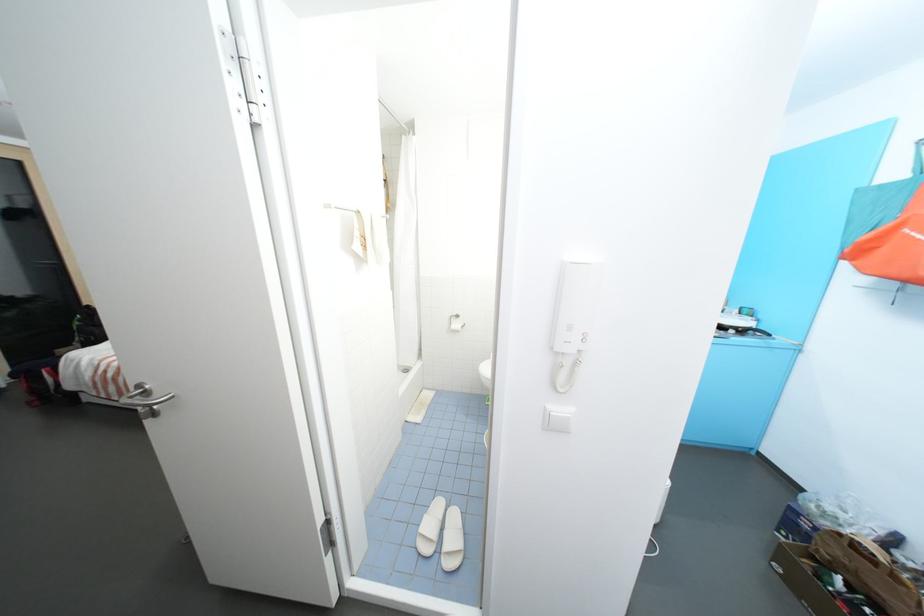
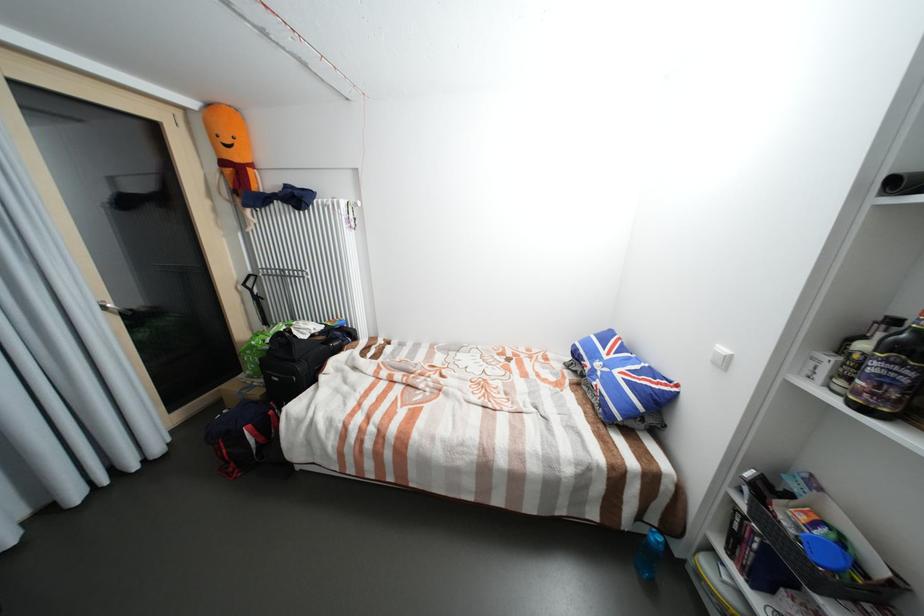
Question: Which direction would the cameraman need to move to produce the second image? Reply with the corresponding letter.

Choices:
 (A) Left
 (B) Right
 (C) Forward
 (D) Backward

Answer: (A)